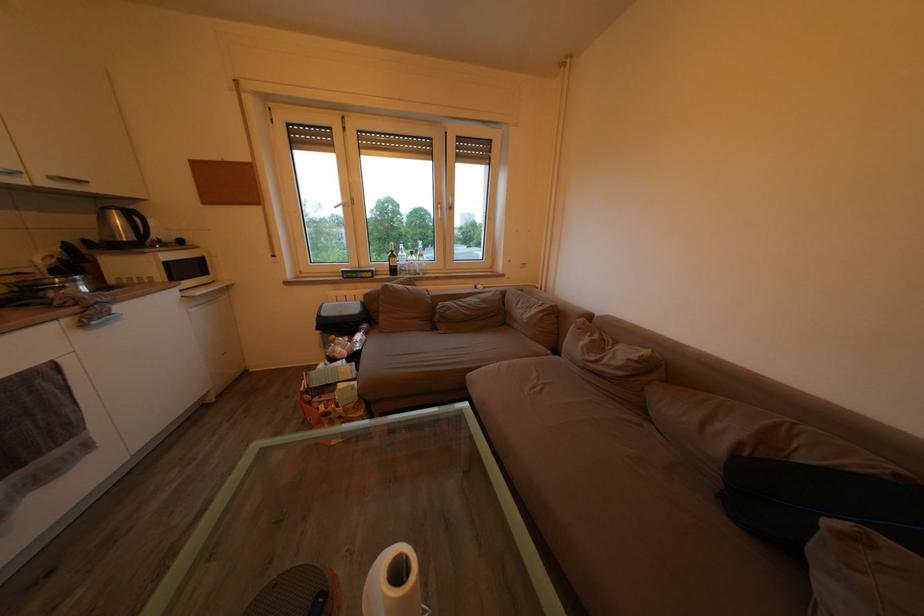
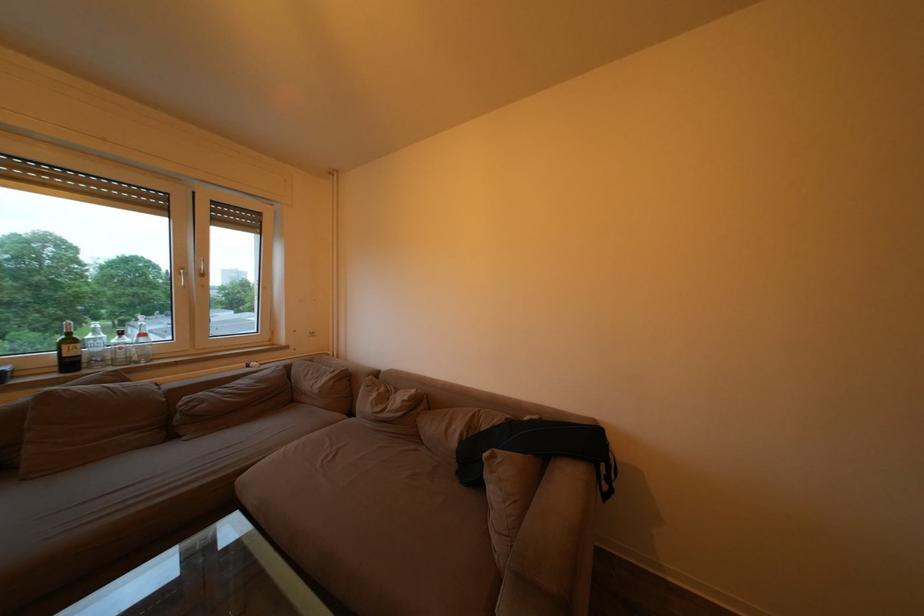
The point at (x=442, y=334) is marked in the first image. Where is the corresponding point in the second image?

(178, 443)